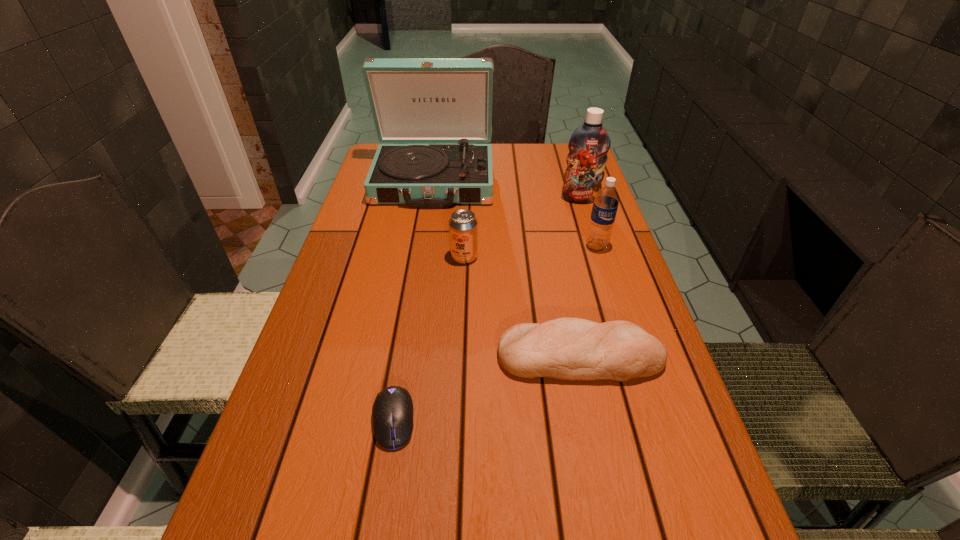
The width and height of the screenshot is (960, 540). I want to click on free region at the far edge, so pyautogui.click(x=518, y=172).

In the image, there is a desktop. At what (x,y) coordinates should I click in order to perform the action: click on vacant space at the left edge. Please return your answer as a coordinate pair (x, y). The width and height of the screenshot is (960, 540). Looking at the image, I should click on (396, 222).

Image resolution: width=960 pixels, height=540 pixels. I want to click on vacant space at the right edge of the desktop, so click(714, 508).

Where is `free location at the far right corner of the desktop`? This screenshot has height=540, width=960. free location at the far right corner of the desktop is located at coordinates point(566,151).

Locate an element on the screen. free space between the shampoo and the beer can is located at coordinates (522, 228).

Image resolution: width=960 pixels, height=540 pixels. What are the coordinates of `free space between the shortest object and the water bottle` in the screenshot? It's located at (495, 334).

You are a GUI agent. You are given a task and a screenshot of the screen. Output one action in this format:
    pyautogui.click(x=<x>, y=<y>)
    Task: Click on the vacant space that's between the fifth farthest object and the beer can
    
    Given the screenshot: What is the action you would take?
    pyautogui.click(x=522, y=307)

In order to click on empty location between the computer mouse and the fifth farthest object in this screenshot , I will do `click(487, 388)`.

I want to click on free space that is in between the second tallest object and the third shortest object, so click(522, 228).

Identify the location of vacant area that lies between the fifth farthest object and the second tallest object. This screenshot has height=540, width=960. (580, 278).